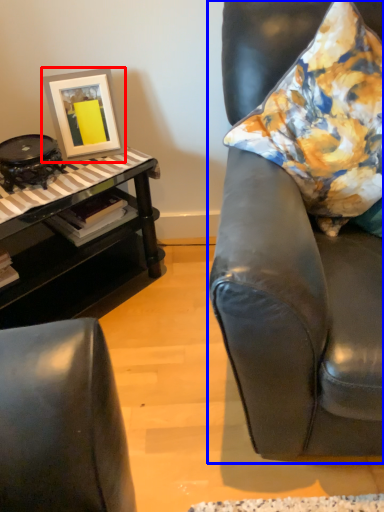
Question: Which object is further to the camera taking this photo, picture frame (highlighted by a red box) or chair (highlighted by a blue box)?

Choices:
 (A) picture frame
 (B) chair

Answer: (A)